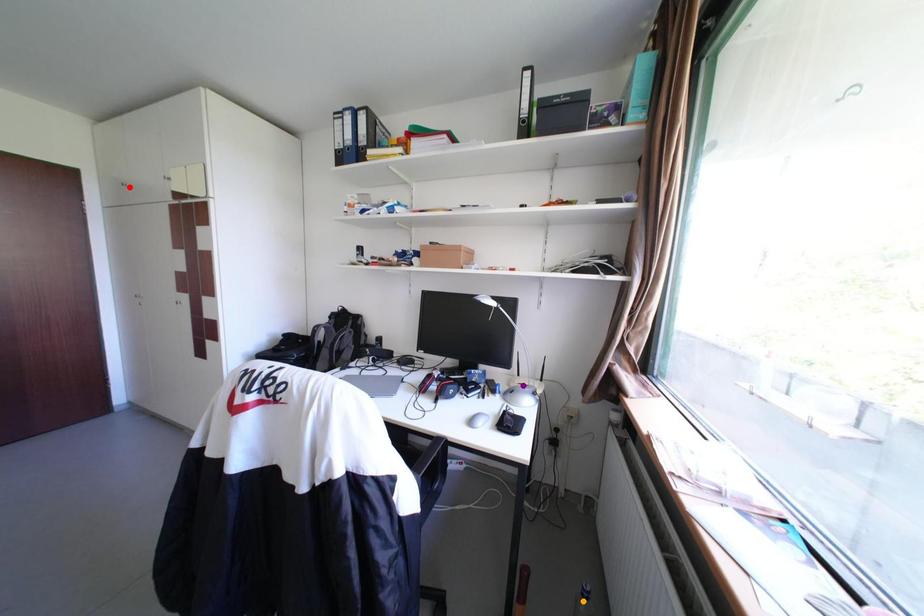
Order these from nearest to farthest:
A) red point
B) orange point
C) purple point

orange point → purple point → red point